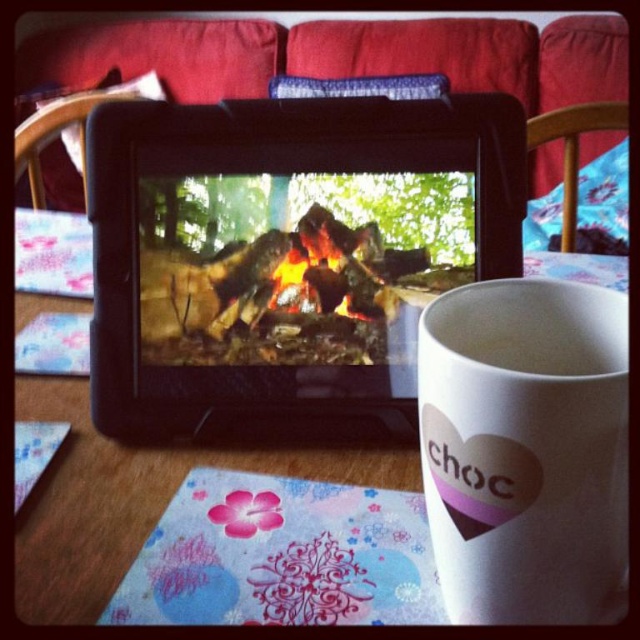
Question: Is white matte mug at center to the right of charcoal wood fire at center from the viewer's perspective?

Choices:
 (A) yes
 (B) no

Answer: (A)

Question: Which of the following is the farthest from the observer?

Choices:
 (A) white matte mug at center
 (B) wooden table at center
 (C) charcoal wood fire at center

Answer: (C)

Question: Is wooden table at center thinner than charcoal wood fire at center?

Choices:
 (A) yes
 (B) no

Answer: (B)

Question: Which of the following is the farthest from the observer?

Choices:
 (A) white matte mug at center
 (B) wooden table at center

Answer: (B)

Question: Is white matte mug at center above wooden table at center?

Choices:
 (A) no
 (B) yes

Answer: (A)

Question: Which point is farther to the camera?

Choices:
 (A) charcoal wood fire at center
 (B) white matte mug at center

Answer: (A)